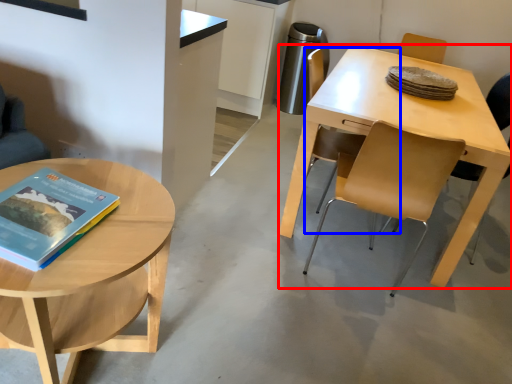
Question: Which point is further to the camera, desk (highlighted by a red box) or chair (highlighted by a blue box)?

Choices:
 (A) desk
 (B) chair

Answer: (B)